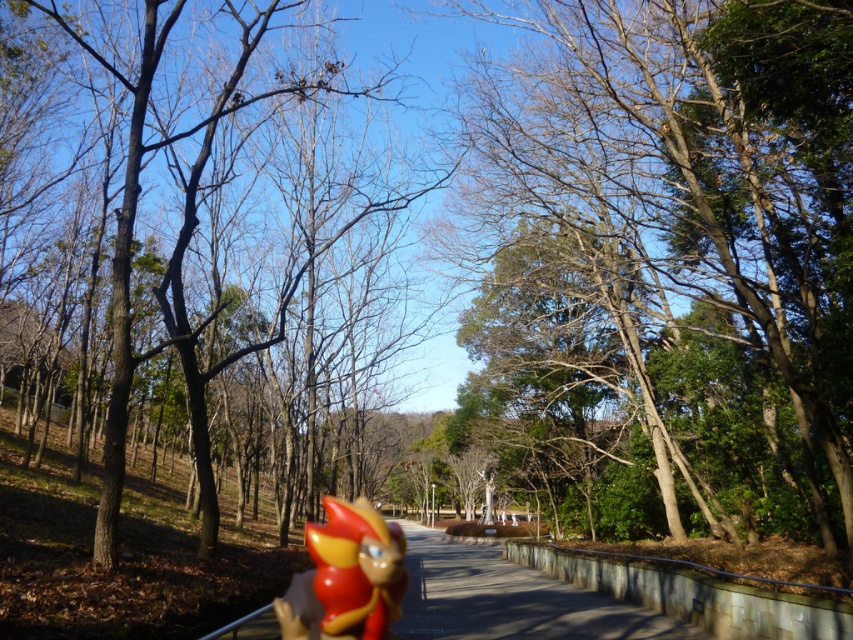
Does brown bark tree at center come behind glossy plastic toy at center?

No, it is in front of glossy plastic toy at center.

Is point (142, 42) positioned after point (376, 618)?

That is True.

Identify the location of brown bark tree at center. The image size is (853, 640). (177, 262).

Is point (788, 388) closer to viewer compared to point (318, 531)?

That is True.

Between point (538, 76) and point (398, 592), which one is positioned behind?

The point (398, 592) is behind.

This screenshot has width=853, height=640. Identify the location of smooth bark tree at center. (666, 260).

Does smooth bark tree at center appear on the right side of brown bark tree at center?

Correct, you'll find smooth bark tree at center to the right of brown bark tree at center.

Which of these two, smooth bark tree at center or brown bark tree at center, stands shorter?

With less height is brown bark tree at center.

Locate an element on the screen. smooth bark tree at center is located at coordinates (666, 260).